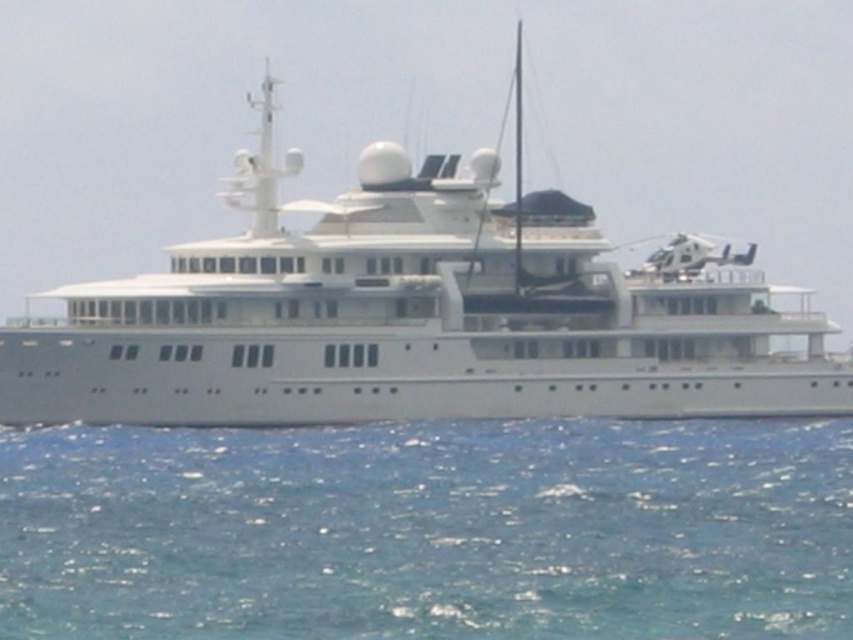
You are a photographer trying to capture the white glossy cruise ship at center from the blue water at lower center. Considering the size difference, which object will appear larger in your photo?

The white glossy cruise ship at center will appear larger in the photo because it is bigger in size compared to the blue water at lower center.